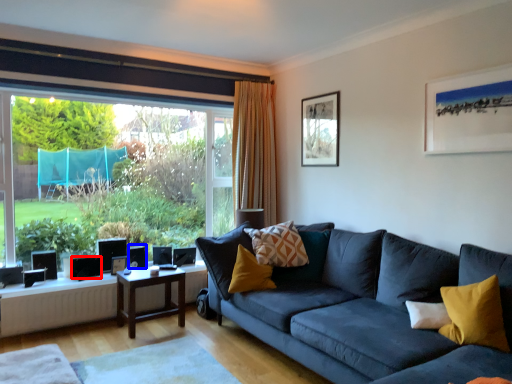
Question: Which object appears farthest to the camera in this image, speaker (highlighted by a red box) or speaker (highlighted by a blue box)?

Choices:
 (A) speaker
 (B) speaker

Answer: (B)